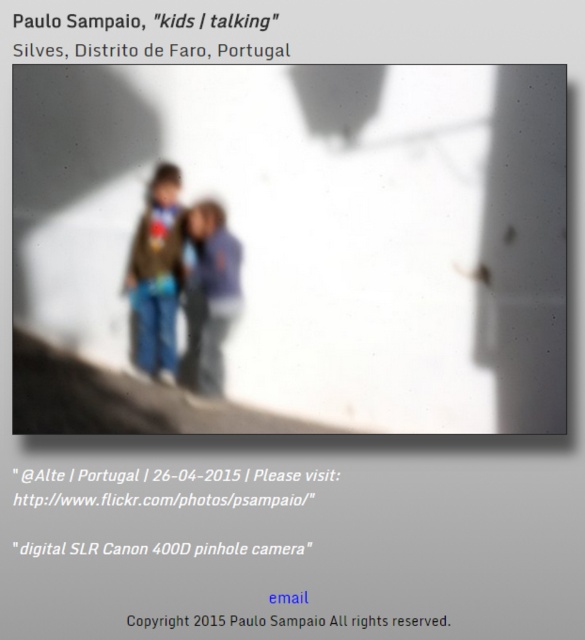
Question: Among these objects, which one is nearest to the camera?

Choices:
 (A) matte blue jeans at center
 (B) matte brown jacket at center

Answer: (B)

Question: Can you confirm if matte brown jacket at center is smaller than matte blue jeans at center?

Choices:
 (A) no
 (B) yes

Answer: (A)

Question: Which point appears closest to the camera in this image?

Choices:
 (A) (139, 243)
 (B) (211, 323)

Answer: (A)

Question: Observing the image, what is the correct spatial positioning of matte brown jacket at center in reference to matte blue jeans at center?

Choices:
 (A) left
 (B) right

Answer: (A)

Question: Can you confirm if matte brown jacket at center is positioned below matte blue jeans at center?

Choices:
 (A) no
 (B) yes

Answer: (A)

Question: Which object appears farthest from the camera in this image?

Choices:
 (A) matte brown jacket at center
 (B) matte blue jeans at center

Answer: (B)